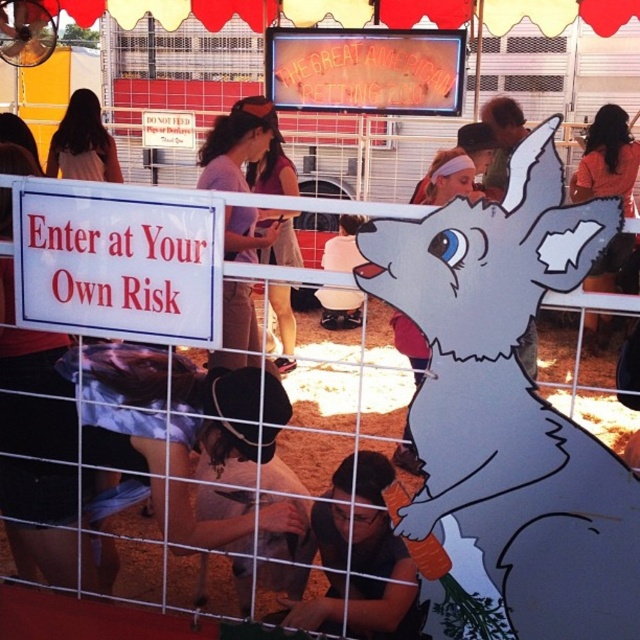
Question: Does light purple fabric at center appear on the right side of purple fabric shirt at center?

Choices:
 (A) no
 (B) yes

Answer: (B)

Question: Which point is farther to the camera?

Choices:
 (A) (257, 257)
 (B) (77, 173)
 (C) (257, 570)

Answer: (B)

Question: Estimate the real-world distances between objects in this image. Which object is closer to the light purple fabric at center?

Choices:
 (A) orange fabric at upper right
 (B) matte white rabbit at center
 (C) blonde hair at upper left

Answer: (C)

Question: Considering the relative positions of gray paper cutout at center and blonde hair at upper left in the image provided, where is gray paper cutout at center located with respect to blonde hair at upper left?

Choices:
 (A) right
 (B) left

Answer: (A)

Question: Does light purple fabric at center appear on the right side of matte white rabbit at center?

Choices:
 (A) no
 (B) yes

Answer: (A)

Question: Which object appears closest to the camera in this image?

Choices:
 (A) light purple fabric at center
 (B) soft gray fur at center
 (C) white paper sign at center

Answer: (C)